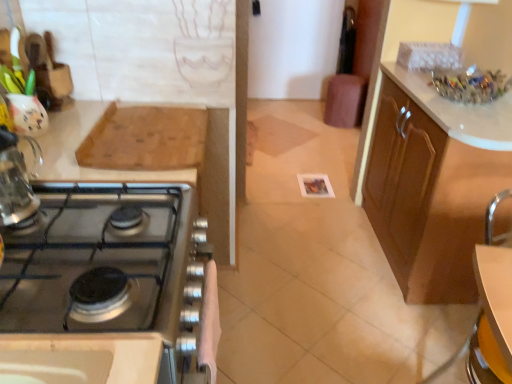
Question: Does brown leather bar stool at center appear on the right side of white glossy table at lower right?

Choices:
 (A) no
 (B) yes

Answer: (B)

Question: From the image's perspective, is brown leather bar stool at center located above white glossy table at lower right?

Choices:
 (A) yes
 (B) no

Answer: (A)

Question: Is brown leather bar stool at center further to the viewer compared to white glossy table at lower right?

Choices:
 (A) no
 (B) yes

Answer: (B)

Question: Does brown leather bar stool at center appear on the left side of white glossy table at lower right?

Choices:
 (A) no
 (B) yes

Answer: (A)

Question: Is brown leather bar stool at center in contact with white glossy table at lower right?

Choices:
 (A) yes
 (B) no

Answer: (B)

Question: Would you say brown leather bar stool at center is a long distance from white glossy table at lower right?

Choices:
 (A) no
 (B) yes

Answer: (B)

Question: From a real-world perspective, is wooden cutting board at upper left located beneath white glossy table at lower right?

Choices:
 (A) yes
 (B) no

Answer: (B)

Question: From a real-world perspective, is wooden cutting board at upper left over white glossy table at lower right?

Choices:
 (A) no
 (B) yes

Answer: (B)

Question: Can you confirm if wooden cutting board at upper left is bigger than white glossy table at lower right?

Choices:
 (A) yes
 (B) no

Answer: (A)

Question: Is wooden cutting board at upper left oriented away from white glossy table at lower right?

Choices:
 (A) yes
 (B) no

Answer: (B)

Question: Is wooden cutting board at upper left placed right next to white glossy table at lower right?

Choices:
 (A) yes
 (B) no

Answer: (B)

Question: Does wooden cutting board at upper left appear on the left side of white glossy table at lower right?

Choices:
 (A) no
 (B) yes

Answer: (B)

Question: Does wooden cutting board at upper left have a greater height compared to brown wood cabinet at right, which ranks as the first cabinetry in back-to-front order?

Choices:
 (A) no
 (B) yes

Answer: (A)